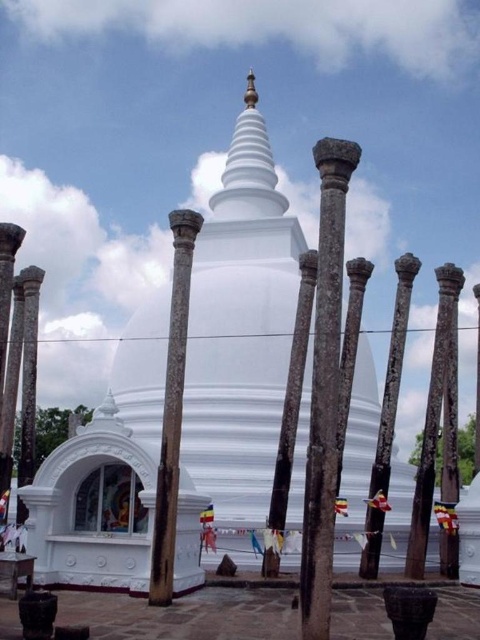
Which is in front, point (385, 440) or point (276, 561)?

Point (276, 561) is in front.

Does smooth stone column at center have a lesser height compared to smooth stone pole at center?

Yes.

I want to click on smooth stone column at center, so click(387, 419).

Looking at this image, between brown stone column at center and rusty metal pole at center, which one has less height?

With less height is rusty metal pole at center.

What are the coordinates of `brown stone column at center` in the screenshot? It's located at coord(324,388).

Is the position of brown stone column at center more distant than that of smooth stone pole at center?

No, it is not.

Is brown stone column at center to the right of smooth stone pole at center from the viewer's perspective?

Indeed, brown stone column at center is positioned on the right side of smooth stone pole at center.

Which is behind, point (324, 301) or point (262, 568)?

Point (262, 568)

Locate an element on the screen. The height and width of the screenshot is (640, 480). brown stone column at center is located at coordinates click(x=324, y=388).